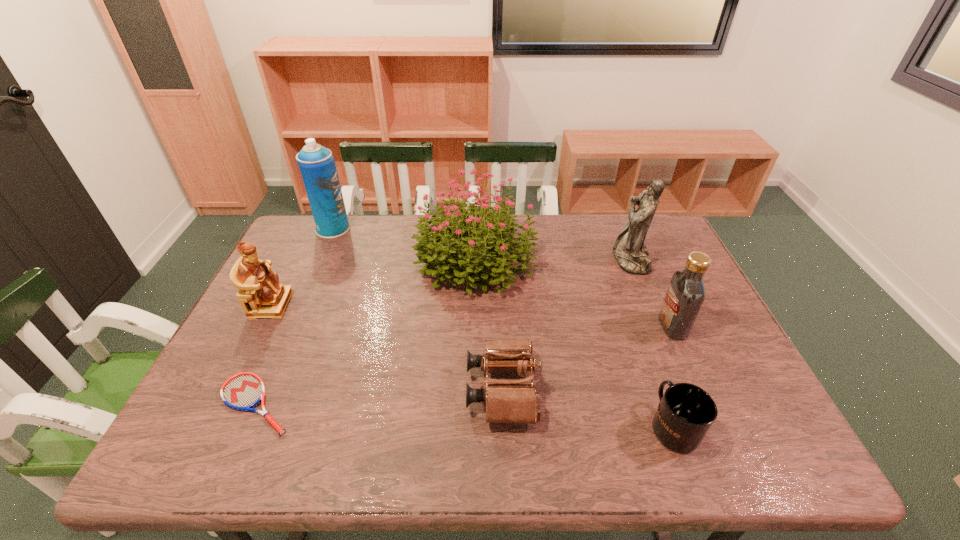
The height and width of the screenshot is (540, 960). I want to click on free area in between the shortest object and the binoculars, so click(x=379, y=396).

At what (x,y) coordinates should I click in order to perform the action: click on free space between the right figurine and the mug. Please return your answer as a coordinate pair (x, y). Looking at the image, I should click on (652, 342).

You are a GUI agent. You are given a task and a screenshot of the screen. Output one action in this format:
    pyautogui.click(x=<x>, y=<y>)
    Task: Click on the third closest object relative to the binoculars
    
    Given the screenshot: What is the action you would take?
    pyautogui.click(x=686, y=293)

Where is `object that can be found as the closest to the aerosol can`? This screenshot has width=960, height=540. object that can be found as the closest to the aerosol can is located at coordinates pos(489,243).

Identify the location of free space that satisfies the following two spatial constraints: 1. on the front-facing side of the right figurine; 2. on the front side of the tennis racket. This screenshot has width=960, height=540. (689, 404).